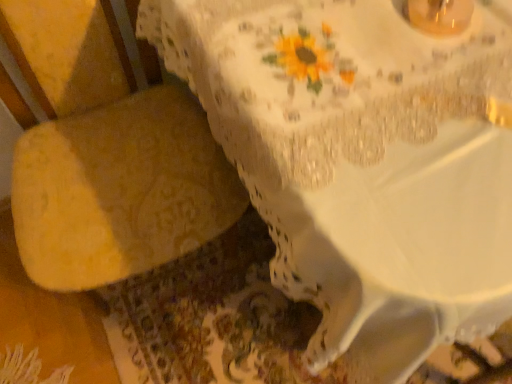
Describe the element at coordinates (362, 162) in the screenshot. The width and height of the screenshot is (512, 384). I see `white lace tablecloth at upper center` at that location.

Image resolution: width=512 pixels, height=384 pixels. I want to click on white lace tablecloth at upper center, so click(x=362, y=162).

Identify the location of yellow fabric armchair at left. (120, 190).

This screenshot has height=384, width=512. What do you see at coordinates (120, 190) in the screenshot? I see `yellow fabric armchair at left` at bounding box center [120, 190].

Locate an element on the screen. Image resolution: width=512 pixels, height=384 pixels. white lace tablecloth at upper center is located at coordinates (362, 162).

From the picture: Between yellow fabric armchair at left and white lace tablecloth at upper center, which one appears on the right side from the viewer's perspective?

Positioned to the right is white lace tablecloth at upper center.

Does yellow fabric armchair at left lie in front of white lace tablecloth at upper center?

Yes, it is.

Is point (84, 182) positioned after point (226, 5)?

Yes.

From the image's perspective, is yellow fabric armchair at left located above or below white lace tablecloth at upper center?

Based on their image positions, yellow fabric armchair at left is located beneath white lace tablecloth at upper center.

From a real-world perspective, between yellow fabric armchair at left and white lace tablecloth at upper center, who is vertically higher?

yellow fabric armchair at left is physically above.

Between yellow fabric armchair at left and white lace tablecloth at upper center, which one has larger width?

Wider between the two is white lace tablecloth at upper center.

Can you confirm if yellow fabric armchair at left is taller than white lace tablecloth at upper center?

Yes, yellow fabric armchair at left is taller than white lace tablecloth at upper center.

Who is smaller, yellow fabric armchair at left or white lace tablecloth at upper center?

yellow fabric armchair at left.

Is yellow fabric armchair at left inside the boundaries of white lace tablecloth at upper center, or outside?

yellow fabric armchair at left is outside white lace tablecloth at upper center.

Looking at this image, is yellow fabric armchair at left in contact with white lace tablecloth at upper center?

No, yellow fabric armchair at left is not touching white lace tablecloth at upper center.

Is yellow fabric armchair at left facing away from white lace tablecloth at upper center?

yellow fabric armchair at left is not turned away from white lace tablecloth at upper center.

How different are the orientations of yellow fabric armchair at left and white lace tablecloth at upper center in degrees?

0.862 degrees separate the facing orientations of yellow fabric armchair at left and white lace tablecloth at upper center.

Locate an element on the screen. armchair in front of the white lace tablecloth at upper center is located at coordinates (120, 190).

Which object is positioned more to the left, white lace tablecloth at upper center or yellow fabric armchair at left?

yellow fabric armchair at left.

Which object is closer to the camera taking this photo, white lace tablecloth at upper center or yellow fabric armchair at left?

yellow fabric armchair at left is closer to the camera.

Is point (352, 87) less distant than point (160, 174)?

Yes, it is.

From the image's perspective, is white lace tablecloth at upper center under yellow fabric armchair at left?

No.

From a real-world perspective, does white lace tablecloth at upper center sit lower than yellow fabric armchair at left?

Yes, from a real-world perspective, white lace tablecloth at upper center is below yellow fabric armchair at left.

Which object is thinner, white lace tablecloth at upper center or yellow fabric armchair at left?

yellow fabric armchair at left.

In terms of height, does white lace tablecloth at upper center look taller or shorter compared to yellow fabric armchair at left?

white lace tablecloth at upper center is shorter than yellow fabric armchair at left.

Who is bigger, white lace tablecloth at upper center or yellow fabric armchair at left?

white lace tablecloth at upper center.

Is yellow fabric armchair at left surrounded by white lace tablecloth at upper center?

No, yellow fabric armchair at left is located outside of white lace tablecloth at upper center.

Is white lace tablecloth at upper center not near yellow fabric armchair at left?

No, white lace tablecloth at upper center is not far from yellow fabric armchair at left.

Is white lace tablecloth at upper center facing towards yellow fabric armchair at left?

No, white lace tablecloth at upper center is not turned towards yellow fabric armchair at left.

The width and height of the screenshot is (512, 384). I want to click on armchair above the white lace tablecloth at upper center (from a real-world perspective), so click(x=120, y=190).

What are the coordinates of `armchair that is above the white lace tablecloth at upper center (from a real-world perspective)` in the screenshot? It's located at (120, 190).

Where is `table that appears above the yellow fabric armchair at left (from the image's perspective)`? Image resolution: width=512 pixels, height=384 pixels. table that appears above the yellow fabric armchair at left (from the image's perspective) is located at coordinates (362, 162).